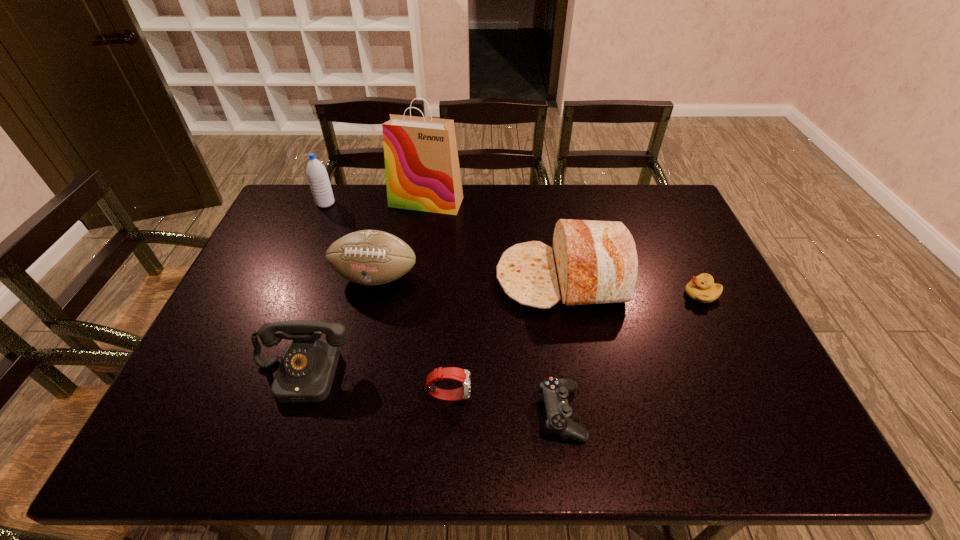
Identify the location of vacant region located 0.240m on the front of the water bottle. The height and width of the screenshot is (540, 960). (303, 255).

You are a GUI agent. You are given a task and a screenshot of the screen. Output one action in this format:
    pyautogui.click(x=<x>, y=<y>)
    Task: Click on the vacant space located at the sliced end of the bread
    The height and width of the screenshot is (540, 960).
    Given the screenshot: What is the action you would take?
    pyautogui.click(x=367, y=279)

This screenshot has height=540, width=960. I want to click on vacant area situated 0.380m at the sliced end of the bread, so click(367, 279).

Identify the location of free region located at the sliced end of the bread. (424, 279).

The image size is (960, 540). Identify the location of vacant space located on the laces of the football (American). (353, 369).

Image resolution: width=960 pixels, height=540 pixels. What are the coordinates of `vacant region located 0.050m on the dial of the telephone` in the screenshot? It's located at (285, 424).

This screenshot has width=960, height=540. I want to click on vacant space located on the face of the sixth tallest object, so click(x=540, y=395).

Image resolution: width=960 pixels, height=540 pixels. I want to click on vacant area located on the front-facing side of the duckling, so click(646, 294).

The width and height of the screenshot is (960, 540). Identify the location of free region located 0.260m on the front-facing side of the duckling. (593, 294).

You are a GUI agent. You are given a task and a screenshot of the screen. Output one action in this format:
    pyautogui.click(x=<x>, y=<y>)
    Task: Click on the vacant space located 0.260m on the front-facing side of the duckling
    This screenshot has width=960, height=540.
    Given the screenshot: What is the action you would take?
    pyautogui.click(x=593, y=294)